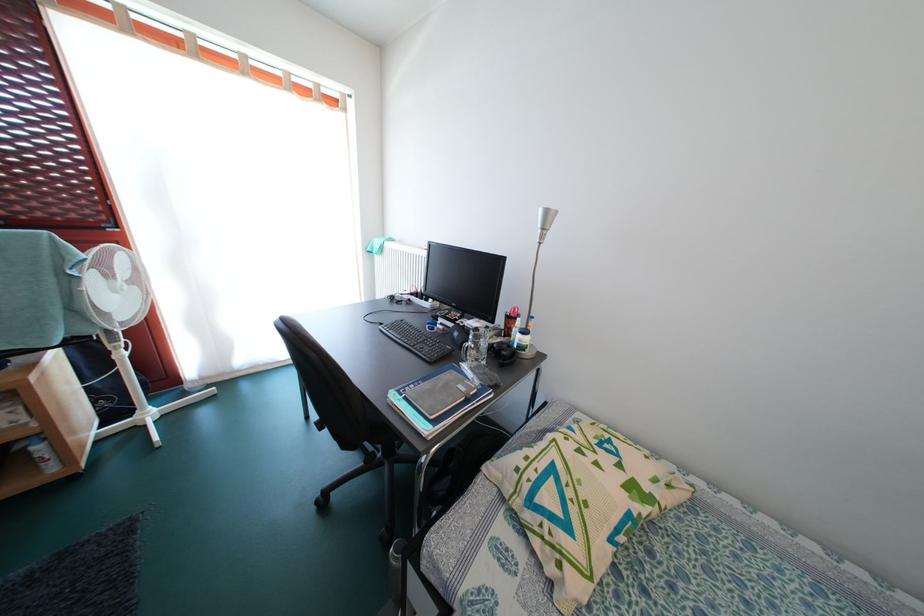
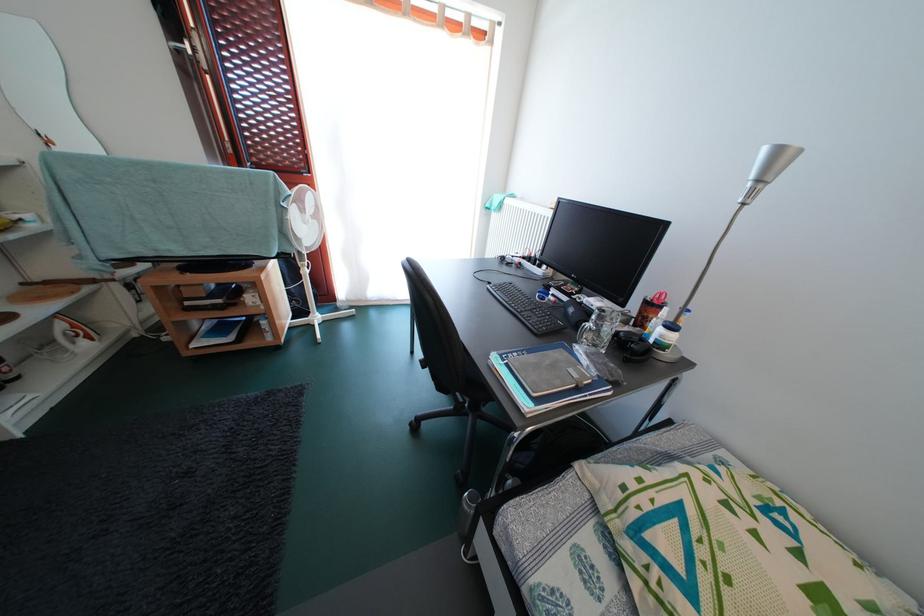
Question: I am providing you with two images of the same scene from different viewpoints. Which of the following objects are not visible in image2?

Choices:
 (A) red pen holder
 (B) black headphones
 (C) black remote control
 (D) none of these

Answer: (D)